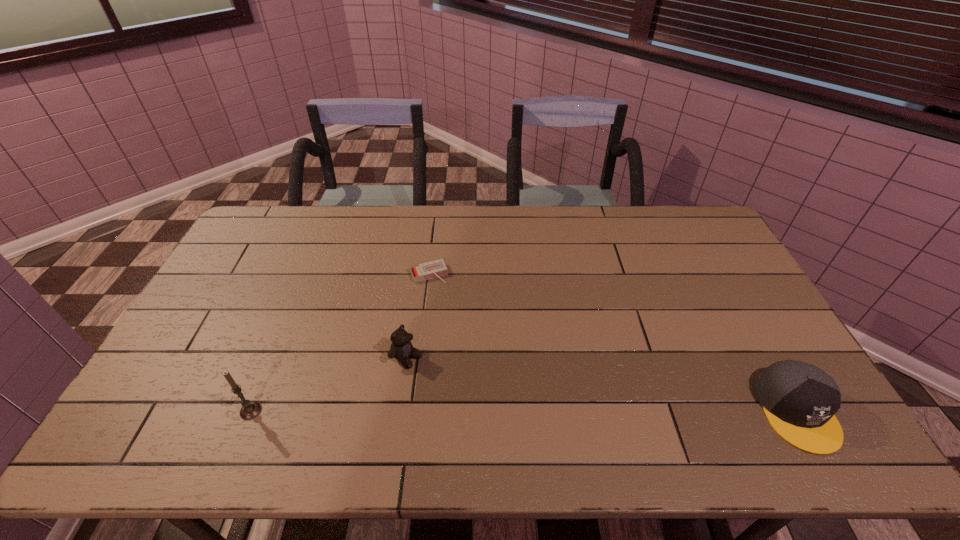
Find the location of a particular element. This screenshot has height=540, width=960. vacant space at the near left corner of the desktop is located at coordinates (150, 393).

Locate an element on the screen. Image resolution: width=960 pixels, height=540 pixels. vacant space at the far right corner of the desktop is located at coordinates (674, 222).

Where is `vacant area that lies between the third nearest object and the candle`? The width and height of the screenshot is (960, 540). vacant area that lies between the third nearest object and the candle is located at coordinates (328, 383).

The image size is (960, 540). Identify the location of vacant point located between the teddy bear and the cap. (602, 384).

You are a GUI agent. You are given a task and a screenshot of the screen. Output one action in this format:
    pyautogui.click(x=<x>, y=<y>)
    Task: Click on the empty space between the tallest object and the rightmost object
    This screenshot has height=540, width=960.
    Given the screenshot: What is the action you would take?
    pyautogui.click(x=524, y=411)

You are a GUI agent. You are given a task and a screenshot of the screen. Output one action in this format:
    pyautogui.click(x=<x>, y=<y>)
    Task: Click on the vacant space in between the teddy bear and the rightmost object
    Image resolution: width=960 pixels, height=540 pixels.
    Given the screenshot: What is the action you would take?
    pyautogui.click(x=602, y=384)

This screenshot has height=540, width=960. I want to click on vacant area between the second farthest object and the rightmost object, so click(602, 384).

Find the location of a particular element. free spot between the teddy bear and the farthest object is located at coordinates (418, 315).

The height and width of the screenshot is (540, 960). Identify the location of vacant area that lies between the tallest object and the matchbox. (340, 342).

Locate an element on the screen. This screenshot has width=960, height=540. vacant space that's between the farthest object and the teddy bear is located at coordinates (418, 315).